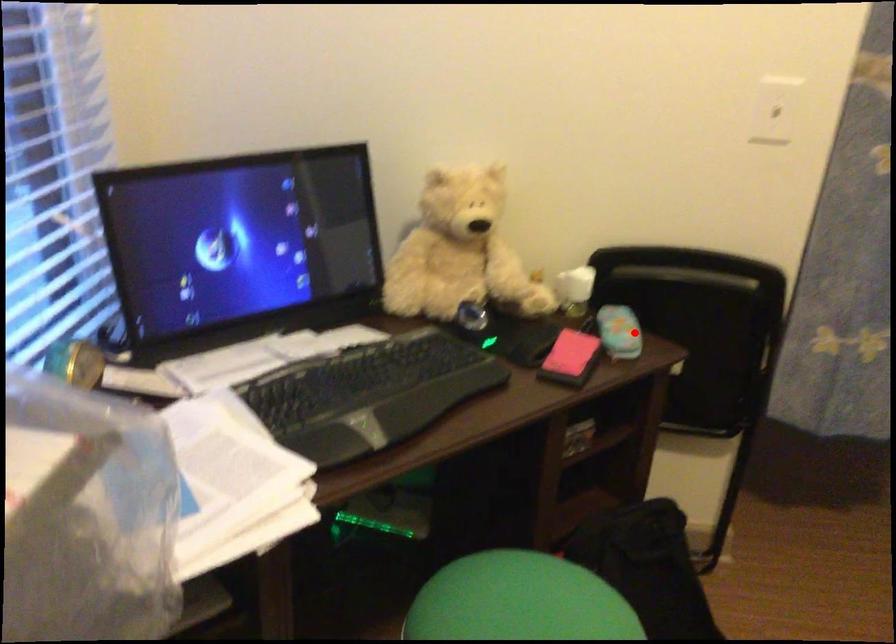
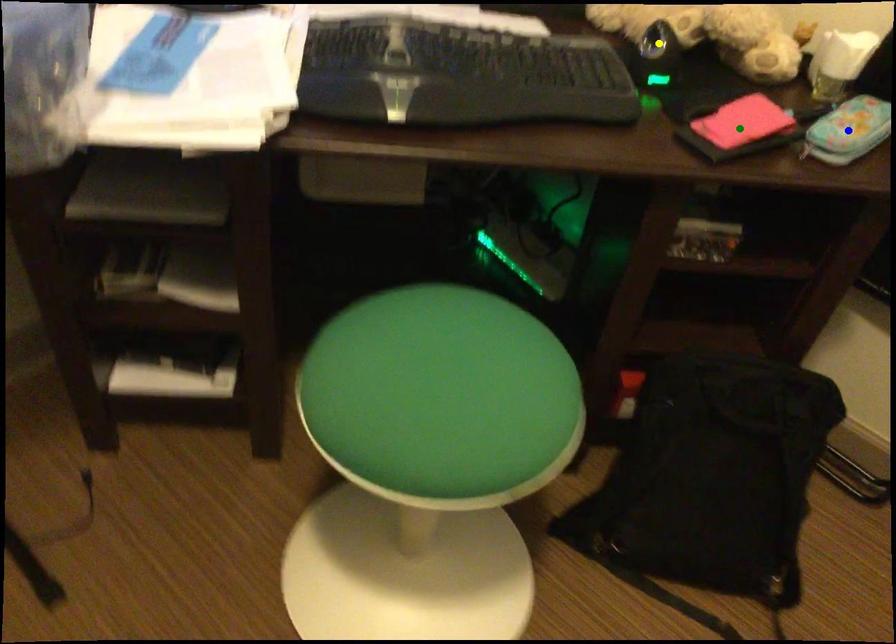
Question: I am providing you with two images of the same scene from different viewpoints. A red point is marked on the first image. You are given multiple points on the second image. Which point in image 2 represents the same 3d spot as the red point in image 1?

Choices:
 (A) yellow point
 (B) green point
 (C) blue point

Answer: (C)